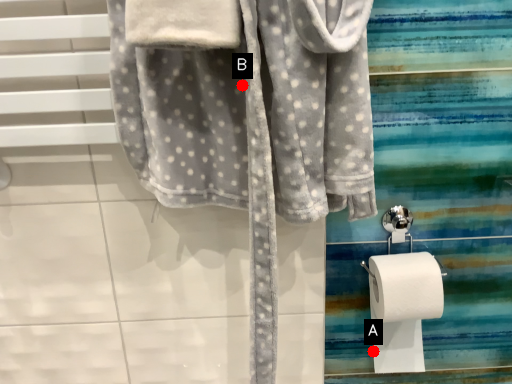
Question: Two points are circled on the image, labeled by A and B beside each circle. Which of the following is the closest to the observer?

Choices:
 (A) A is closer
 (B) B is closer

Answer: (B)